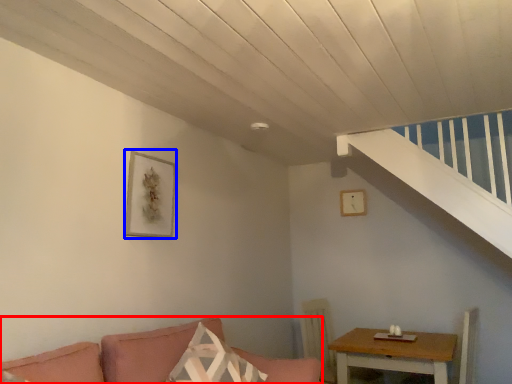
Question: Which point is further to the camera, studio couch (highlighted by a red box) or picture frame (highlighted by a blue box)?

Choices:
 (A) studio couch
 (B) picture frame

Answer: (B)